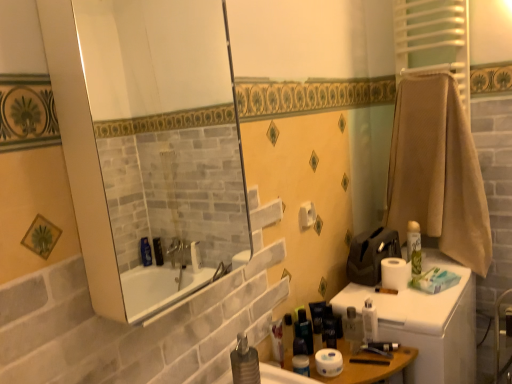
Describe the element at coordinates (414, 247) in the screenshot. I see `green matte spray can at right, the 7th toiletry viewed from the left` at that location.

The image size is (512, 384). Describe the element at coordinates (317, 323) in the screenshot. I see `matte black toiletry at lower center, placed as the third toiletry when sorted from left to right` at that location.

What do you see at coordinates (369, 321) in the screenshot?
I see `white glossy lotion at lower right, placed as the 2th toiletry when sorted from right to left` at bounding box center [369, 321].

Image resolution: width=512 pixels, height=384 pixels. In order to click on translucent plastic bottle at center, the 6th toiletry when ordered from right to left in this screenshot , I will do `click(288, 332)`.

The height and width of the screenshot is (384, 512). What do you see at coordinates (419, 302) in the screenshot?
I see `white plastic toilet at right` at bounding box center [419, 302].

The width and height of the screenshot is (512, 384). Identify the location of green matte spray can at right, which is the first toiletry from right to left. (414, 247).

Is white matte toilet paper at lower center, which is the 3th toilet paper from top to bottom, wider or thinner than matte black container at lower center, which is counted as the 4th toiletry, starting from the left?

white matte toilet paper at lower center, which is the 3th toilet paper from top to bottom, is wider than matte black container at lower center, which is counted as the 4th toiletry, starting from the left.

Considering the sizes of white matte toilet paper at lower center, the first toilet paper in the bottom-to-top sequence, and matte black container at lower center, arranged as the 4th toiletry when viewed from the right, in the image, is white matte toilet paper at lower center, the first toilet paper in the bottom-to-top sequence, taller or shorter than matte black container at lower center, arranged as the 4th toiletry when viewed from the right,?

Clearly, white matte toilet paper at lower center, the first toilet paper in the bottom-to-top sequence, is shorter compared to matte black container at lower center, arranged as the 4th toiletry when viewed from the right.

Based on the photo, from a real-world perspective, relative to matte black container at lower center, arranged as the 4th toiletry when viewed from the right, is white matte toilet paper at lower center, positioned as the 2th toilet paper in left-to-right order, vertically above or below?

white matte toilet paper at lower center, positioned as the 2th toilet paper in left-to-right order, is below matte black container at lower center, arranged as the 4th toiletry when viewed from the right.

You are a GUI agent. You are given a task and a screenshot of the screen. Output one action in this format:
    pyautogui.click(x=<x>, y=<y>)
    Task: Click on the toilet paper below the matte black container at lower center, which is counted as the 4th toiletry, starting from the left (from the image's perspective)
    This screenshot has height=384, width=512.
    Given the screenshot: What is the action you would take?
    pyautogui.click(x=329, y=362)

Which of these two, white glossy lotion at lower right, which appears as the 6th toiletry when viewed from the left, or matte black container at lower center, arranged as the 4th toiletry when viewed from the right, is wider?

white glossy lotion at lower right, which appears as the 6th toiletry when viewed from the left, is wider.

Who is taller, white glossy lotion at lower right, which appears as the 6th toiletry when viewed from the left, or matte black container at lower center, arranged as the 4th toiletry when viewed from the right?

Standing taller between the two is white glossy lotion at lower right, which appears as the 6th toiletry when viewed from the left.

Locate an element on the screen. toiletry that is the 1st one when counting forward from the matte black container at lower center, which is counted as the 4th toiletry, starting from the left is located at coordinates (369, 321).

Is white glossy lotion at lower right, which appears as the 6th toiletry when viewed from the left, far away from matte black container at lower center, arranged as the 4th toiletry when viewed from the right?

No, white glossy lotion at lower right, which appears as the 6th toiletry when viewed from the left, is in close proximity to matte black container at lower center, arranged as the 4th toiletry when viewed from the right.

Is white matte toilet paper at lower center, positioned as the first toilet paper in front-to-back order, taller than white glossy lotion at lower right, placed as the 2th toiletry when sorted from right to left?

No.

From a real-world perspective, between white matte toilet paper at lower center, positioned as the 2th toilet paper in left-to-right order, and white glossy lotion at lower right, which appears as the 6th toiletry when viewed from the left, who is vertically lower?

white matte toilet paper at lower center, positioned as the 2th toilet paper in left-to-right order, is physically lower.

Is white matte toilet paper at lower center, marked as the second toilet paper in a right-to-left arrangement, far from white glossy lotion at lower right, placed as the 2th toiletry when sorted from right to left?

white matte toilet paper at lower center, marked as the second toilet paper in a right-to-left arrangement, is near white glossy lotion at lower right, placed as the 2th toiletry when sorted from right to left, not far away.

Is white matte toilet paper at lower center, marked as the second toilet paper in a right-to-left arrangement, turned away from white glossy lotion at lower right, placed as the 2th toiletry when sorted from right to left?

No, white matte toilet paper at lower center, marked as the second toilet paper in a right-to-left arrangement, is not facing the opposite direction of white glossy lotion at lower right, placed as the 2th toiletry when sorted from right to left.

Is point (330, 325) more distant than point (412, 219)?

No.

From a real-world perspective, is matte black container at lower center, which is counted as the 4th toiletry, starting from the left, positioned above or below beige textured towel at right?

From a real-world perspective, matte black container at lower center, which is counted as the 4th toiletry, starting from the left, is physically below beige textured towel at right.

Between matte black container at lower center, which is counted as the 4th toiletry, starting from the left, and beige textured towel at right, which one appears on the right side from the viewer's perspective?

beige textured towel at right is more to the right.

Based on the photo, is translucent plastic bottle at center, which is the second toiletry from left to right, closer to the viewer compared to green matte spray can at right, the 7th toiletry viewed from the left?

Yes.

From their relative heights in the image, would you say translucent plastic bottle at center, the 6th toiletry when ordered from right to left, is taller or shorter than green matte spray can at right, which is the first toiletry from right to left?

Clearly, translucent plastic bottle at center, the 6th toiletry when ordered from right to left, is shorter compared to green matte spray can at right, which is the first toiletry from right to left.

Visually, is translucent plastic bottle at center, which is the second toiletry from left to right, positioned to the left or to the right of green matte spray can at right, which is the first toiletry from right to left?

Clearly, translucent plastic bottle at center, which is the second toiletry from left to right, is on the left of green matte spray can at right, which is the first toiletry from right to left, in the image.

Can you confirm if translucent plastic bottle at center, which is the second toiletry from left to right, is bigger than green matte spray can at right, the 7th toiletry viewed from the left?

No.

In the scene shown: Which of these two, metallic silver soap dispenser at lower center or green matte spray can at right, which is the first toiletry from right to left, is wider?

green matte spray can at right, which is the first toiletry from right to left, is wider.

Could you tell me if metallic silver soap dispenser at lower center is turned towards green matte spray can at right, which is the first toiletry from right to left?

No, metallic silver soap dispenser at lower center does not turn towards green matte spray can at right, which is the first toiletry from right to left.

Is metallic silver soap dispenser at lower center outside of green matte spray can at right, which is the first toiletry from right to left?

Yes, metallic silver soap dispenser at lower center is located beyond the bounds of green matte spray can at right, which is the first toiletry from right to left.

Which object is positioned more to the right, metallic silver soap dispenser at lower center or green matte spray can at right, the 7th toiletry viewed from the left?

Positioned to the right is green matte spray can at right, the 7th toiletry viewed from the left.

In the image, is matte black soap dispenser at lower right, the 5th toiletry from the left, on the left side or the right side of translucent plastic bottle at center, which is the second toiletry from left to right?

In the image, matte black soap dispenser at lower right, the 5th toiletry from the left, appears on the right side of translucent plastic bottle at center, which is the second toiletry from left to right.

Considering the relative sizes of matte black soap dispenser at lower right, which is the third toiletry in right-to-left order, and translucent plastic bottle at center, the 6th toiletry when ordered from right to left, in the image provided, is matte black soap dispenser at lower right, which is the third toiletry in right-to-left order, smaller than translucent plastic bottle at center, the 6th toiletry when ordered from right to left,?

Incorrect, matte black soap dispenser at lower right, which is the third toiletry in right-to-left order, is not smaller in size than translucent plastic bottle at center, the 6th toiletry when ordered from right to left.

Can you confirm if matte black soap dispenser at lower right, which is the third toiletry in right-to-left order, is shorter than translucent plastic bottle at center, the 6th toiletry when ordered from right to left?

Indeed, matte black soap dispenser at lower right, which is the third toiletry in right-to-left order, has a lesser height compared to translucent plastic bottle at center, the 6th toiletry when ordered from right to left.

Could you tell me if matte black soap dispenser at lower right, the 5th toiletry from the left, is facing translucent plastic bottle at center, the 6th toiletry when ordered from right to left?

No, matte black soap dispenser at lower right, the 5th toiletry from the left, is not turned towards translucent plastic bottle at center, the 6th toiletry when ordered from right to left.

You are a GUI agent. You are given a task and a screenshot of the screen. Output one action in this format:
    pyautogui.click(x=<x>, y=<y>)
    Task: Click on the toilet paper in front of the matte black container at lower center, which is counted as the 4th toiletry, starting from the left
    The image size is (512, 384).
    Given the screenshot: What is the action you would take?
    pyautogui.click(x=329, y=362)

Which toiletry is the 2nd one when counting from the left side of the white glossy lotion at lower right, placed as the 2th toiletry when sorted from right to left? Please provide its 2D coordinates.

[(330, 332)]

Considering their positions, is matte black toiletry at lower center, placed as the third toiletry when sorted from left to right, positioned further to white matte toilet paper at upper center, which is counted as the 1th toilet paper, starting from the left, than translucent plastic bottle at lower center, which is the first toiletry in left-to-right order?

Among the two, translucent plastic bottle at lower center, which is the first toiletry in left-to-right order, is located further to white matte toilet paper at upper center, which is counted as the 1th toilet paper, starting from the left.

Based on their spatial positions, is white matte toilet paper at lower center, the first toilet paper in the bottom-to-top sequence, or white plastic toilet at right further from translucent plastic bottle at center, the 6th toiletry when ordered from right to left?

The object further to translucent plastic bottle at center, the 6th toiletry when ordered from right to left, is white plastic toilet at right.

When comparing their distances from matte black soap dispenser at lower right, which is the third toiletry in right-to-left order, does white glossy lotion at lower right, placed as the 2th toiletry when sorted from right to left, or matte black toiletry at lower center, which ranks as the fifth toiletry in right-to-left order, seem closer?

The object closer to matte black soap dispenser at lower right, which is the third toiletry in right-to-left order, is white glossy lotion at lower right, placed as the 2th toiletry when sorted from right to left.

From the image, which object appears to be nearer to white matte toilet paper at right, which is the third toilet paper from left to right, white glossy lotion at lower right, which appears as the 6th toiletry when viewed from the left, or green matte spray can at right, the 7th toiletry viewed from the left?

Based on the image, green matte spray can at right, the 7th toiletry viewed from the left, appears to be nearer to white matte toilet paper at right, which is the third toilet paper from left to right.

Which object lies further to the anchor point white glossy mirror at upper left, matte black toiletry at lower center, which ranks as the fifth toiletry in right-to-left order, or white plastic toilet at right?

matte black toiletry at lower center, which ranks as the fifth toiletry in right-to-left order.

When comparing their distances from green matte spray can at right, which is the first toiletry from right to left, does metallic silver soap dispenser at lower center or white glossy mirror at upper left seem further?

white glossy mirror at upper left is positioned further to the anchor green matte spray can at right, which is the first toiletry from right to left.

Which object lies further to the anchor point translucent plastic bottle at lower center, which is the first toiletry in left-to-right order, matte black toiletry at lower center, placed as the third toiletry when sorted from left to right, or metallic silver soap dispenser at lower center?

metallic silver soap dispenser at lower center.

Which object lies nearer to the anchor point white matte toilet paper at lower center, positioned as the 2th toilet paper in left-to-right order, matte black toiletry at lower center, placed as the third toiletry when sorted from left to right, or translucent plastic bottle at lower center, which is the first toiletry in left-to-right order?

The object closer to white matte toilet paper at lower center, positioned as the 2th toilet paper in left-to-right order, is matte black toiletry at lower center, placed as the third toiletry when sorted from left to right.

Identify the location of soap dispenser located between white glossy mirror at upper left and white glossy lotion at lower right, placed as the 2th toiletry when sorted from right to left, in the depth direction. (244, 362).

The height and width of the screenshot is (384, 512). What are the coordinates of `counter top located between metallic silver soap dispenser at lower center and beige textured towel at right in the left-right direction` in the screenshot? It's located at (419, 302).

What are the coordinates of `toiletry located between matte black soap dispenser at lower right, which is the third toiletry in right-to-left order, and green matte spray can at right, the 7th toiletry viewed from the left, in the left-right direction` in the screenshot? It's located at (369, 321).

At what (x,y) coordinates should I click in order to perform the action: click on soap dispenser located between white glossy mirror at upper left and white matte toilet paper at upper center, placed as the first toilet paper when sorted from top to bottom, in the depth direction. Please return your answer as a coordinate pair (x, y). Looking at the image, I should click on (244, 362).